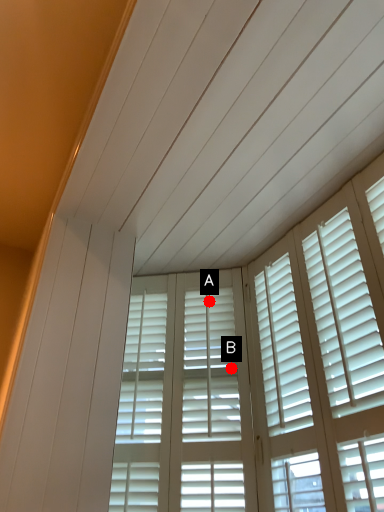
Question: Two points are circled on the image, labeled by A and B beside each circle. Which of the following is the closest to the observer?

Choices:
 (A) A is closer
 (B) B is closer

Answer: (B)